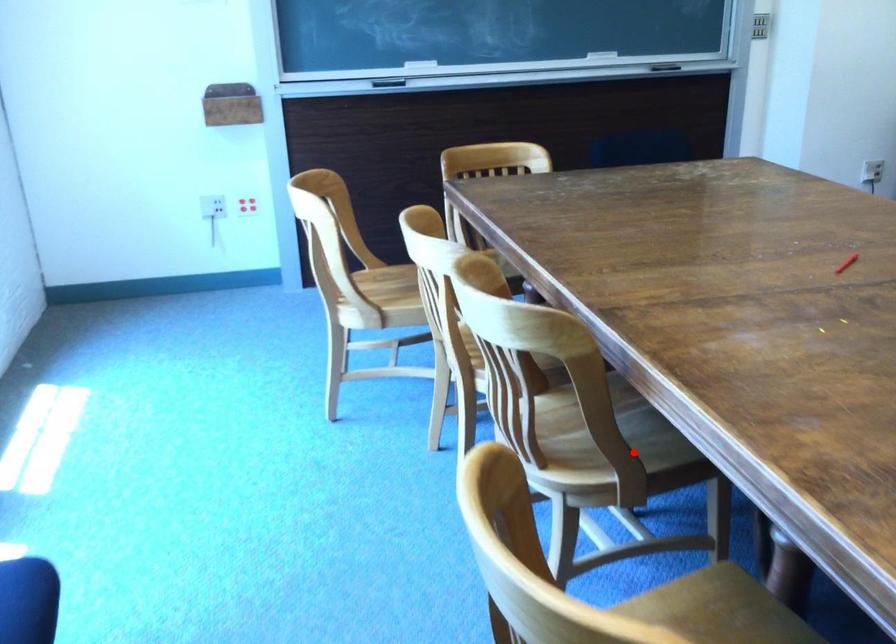
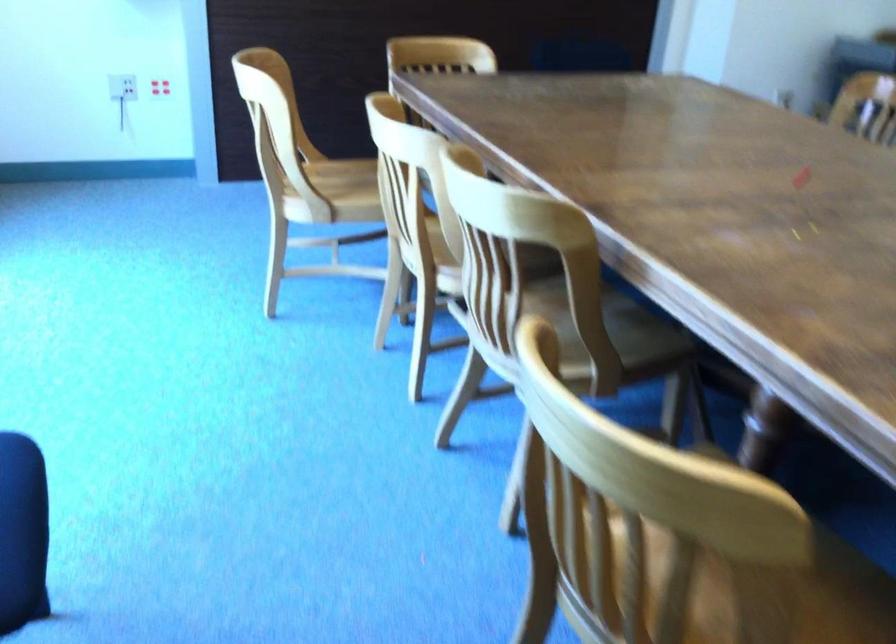
Where in the second image is the point corresponding to the highlighted location from the first image?

(615, 345)